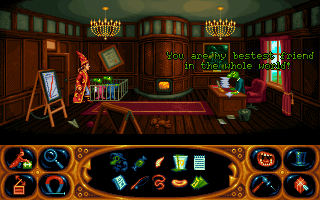
This screenshot has height=200, width=320. What are the coordinates of `window` in the screenshot? It's located at (276, 79).